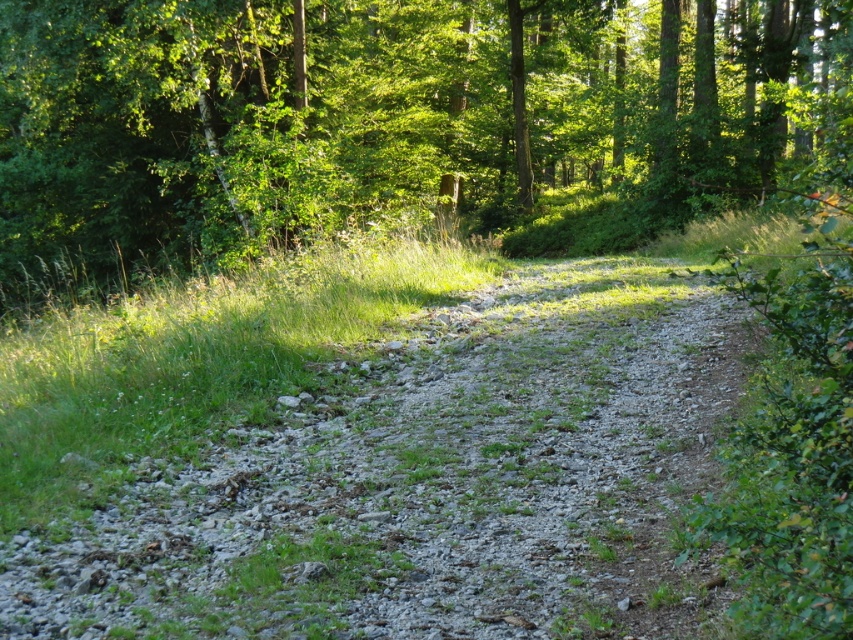
Is green leafy tree at upper center bigger than gray gravel path at center?

Yes, green leafy tree at upper center is bigger than gray gravel path at center.

Locate an element on the screen. The image size is (853, 640). green leafy tree at upper center is located at coordinates (380, 120).